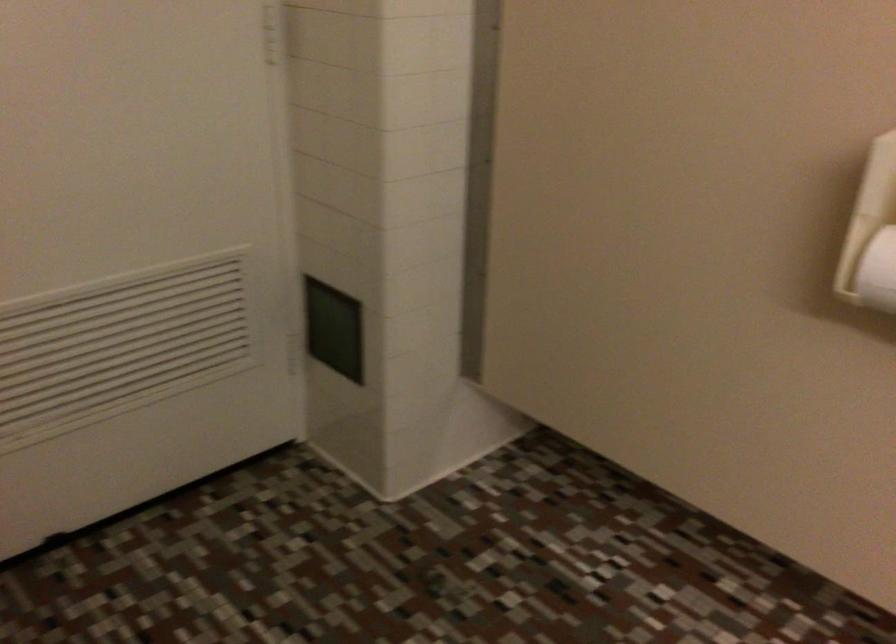
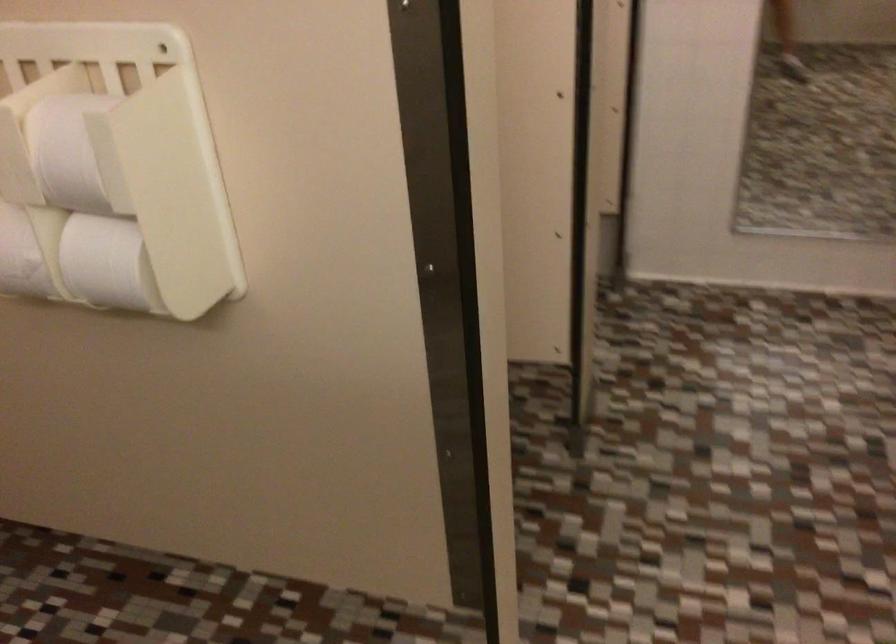
Question: Based on the continuous images, in which direction is the camera rotating? Reply with the corresponding letter.

Choices:
 (A) Left
 (B) Right
 (C) Up
 (D) Down

Answer: (B)